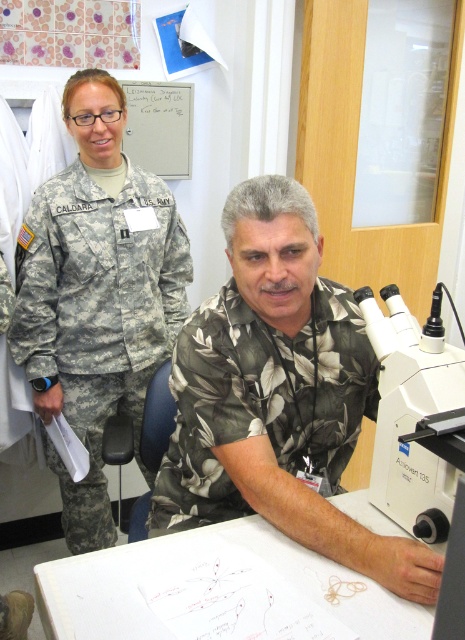
You are a researcher who needs to move a small tool from the floral shirt at center to the white plastic microscope at right. Which direction should you move the tool to place it closer to the microscope?

The floral shirt at center is to the left of the white plastic microscope at right, so you should move the tool to the right to place it closer to the microscope.

You are a researcher in the lab and need to place a 10 cm wide equipment box on the table. The box must be placed exactly at the position of the floral shirt at center. Is there enough space there?

The position of floral shirt at center is at point (278, 396), but the exact dimensions of the table and surrounding objects are not provided. Without knowing the table size or nearby obstructions, it is impossible to determine if the 10 cm wide equipment box can be placed there safely.